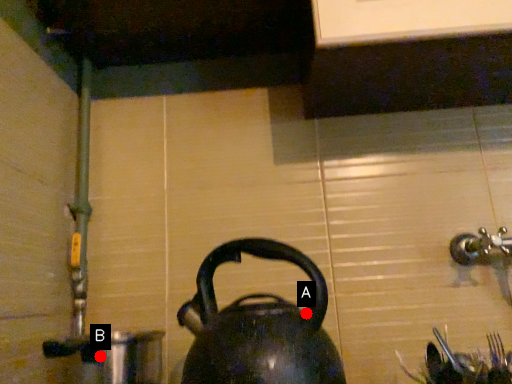
Question: Two points are circled on the image, labeled by A and B beside each circle. Which point is farther to the camera?

Choices:
 (A) A is further
 (B) B is further

Answer: (B)